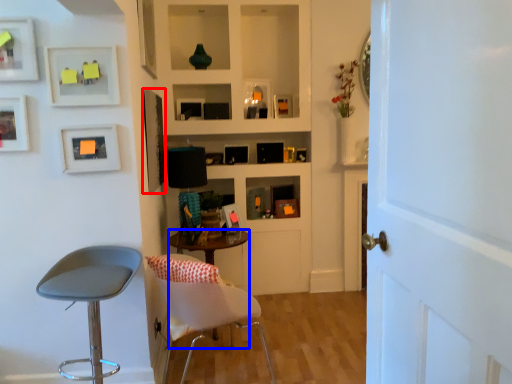
Question: Which of the following is the closest to the observer, picture frame (highlighted by a red box) or desk (highlighted by a blue box)?

Choices:
 (A) picture frame
 (B) desk

Answer: (B)